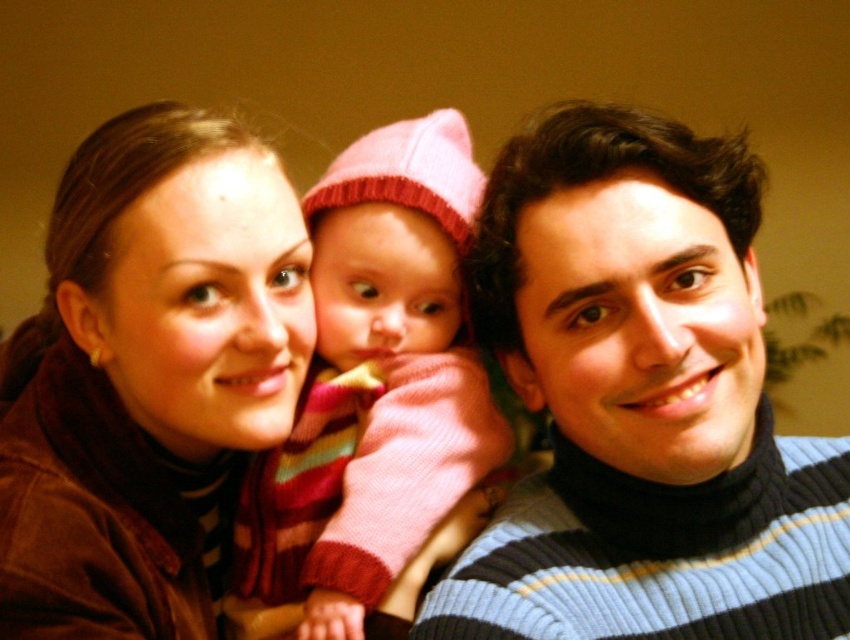
You are a photographer trying to capture a closeup of the baby. You need to adjust your camera focus to ensure both the striped knit sweater at center and the pink knitted hat at center are in focus. Which object should you focus on first to ensure the other is also in focus?

The striped knit sweater at center is below the pink knitted hat at center. Since the sweater is lower, focusing on the pink knitted hat at center first would ensure the sweater is also in focus due to its proximity in depth.